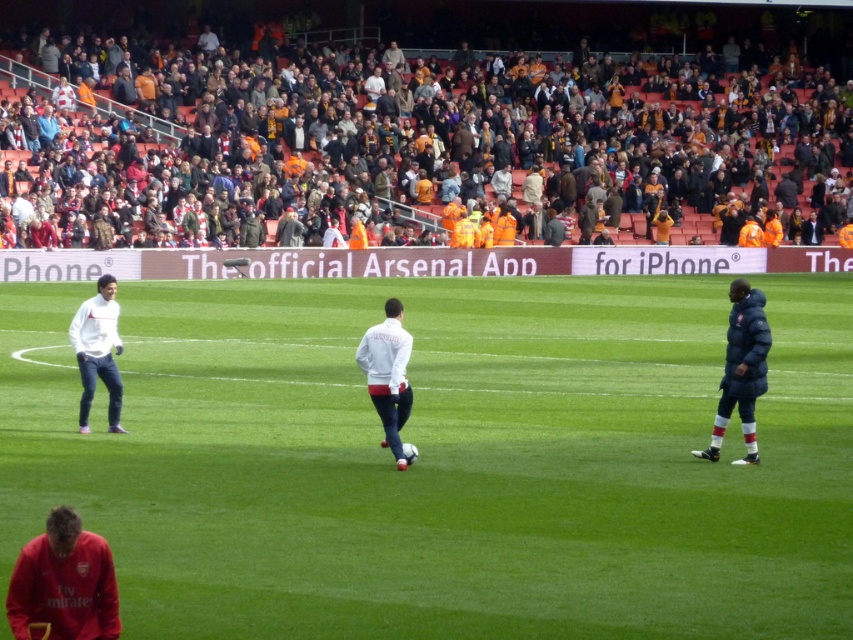
You are a spectator at the stadium and want to find the best spot to watch the training session. You have to choose between the green grass at center and the brown leather seats at upper center. Which location offers a better view of the training session happening on the pitch?

The green grass at center is to the left of the brown leather seats at upper center, so the brown leather seats at upper center are positioned higher and further back, providing a better elevated view of the training session on the pitch compared to the green grass at center.

You are a drone operator tasked with capturing aerial footage of the soccer training session. The drone must stay within a 100 feet radius from the white matte jacket at left to avoid interfering with the players. Can the drone safely fly to the brown leather seats at upper center without exceeding this radius?

The brown leather seats at upper center is 93.32 feet away from the white matte jacket at left. Since 93.32 feet is within the 100 feet radius, the drone can safely fly to the brown leather seats at upper center without exceeding the radius.